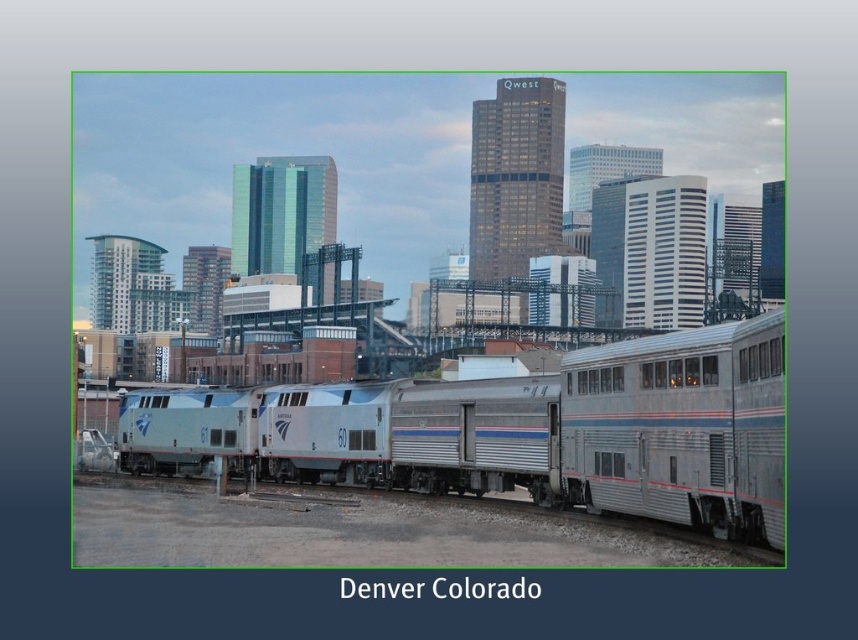
Between silver metallic train at center and silver metallic train car at center, which one is positioned lower?

silver metallic train car at center is lower down.

Can you confirm if silver metallic train at center is thinner than silver metallic train car at center?

No.

Which is behind, point (599, 449) or point (221, 396)?

Point (221, 396)

The width and height of the screenshot is (858, 640). In order to click on silver metallic train at center in this screenshot , I will do `click(559, 432)`.